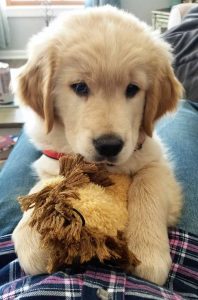
Find the location of `grey cover`. grey cover is located at coordinates (187, 45).